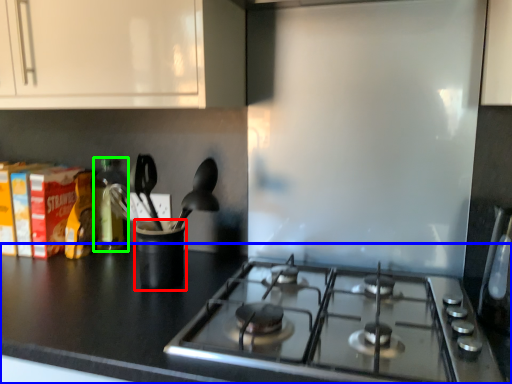
Question: Estimate the real-world distances between objects in this image. Which object is farther from appliance (highlighted by a red box), countertop (highlighted by a blue box) or bottle (highlighted by a green box)?

Choices:
 (A) countertop
 (B) bottle

Answer: (B)